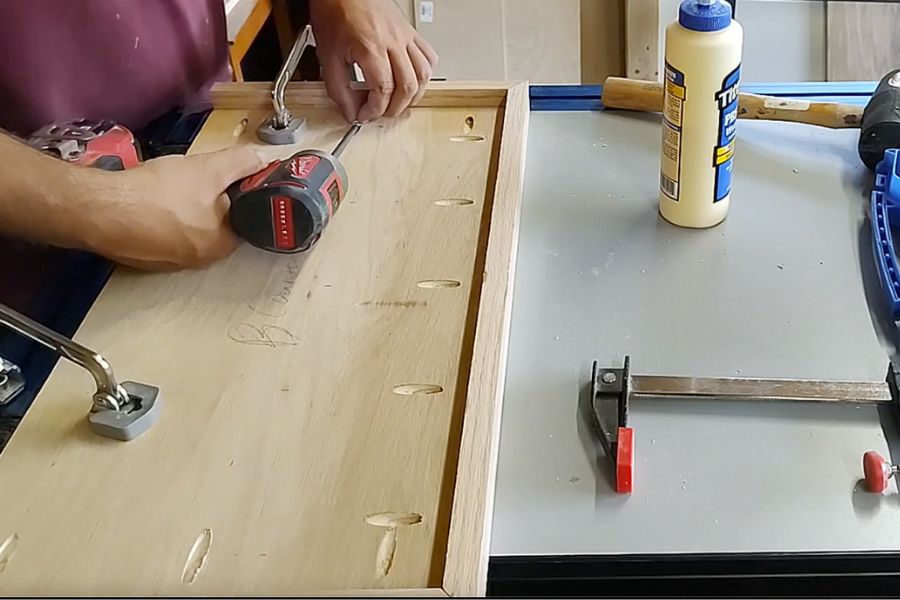
This screenshot has height=600, width=900. I want to click on wooden work bench, so click(x=310, y=471).